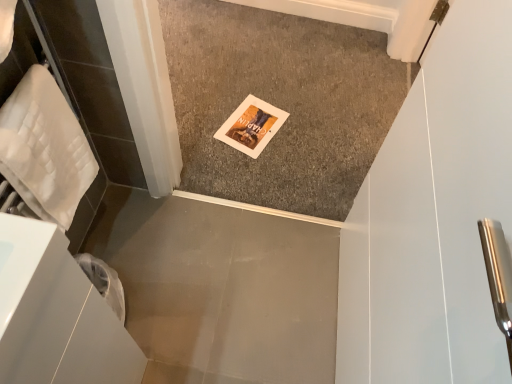
Question: Would you say smooth gray concrete at lower left, arranged as the 2th concrete when viewed from the top, is outside carpeted floor at center, positioned as the first concrete in back-to-front order?

Choices:
 (A) yes
 (B) no

Answer: (A)

Question: From the image's perspective, is smooth gray concrete at lower left, the 1th concrete ordered from the bottom, on carpeted floor at center, positioned as the first concrete in back-to-front order?

Choices:
 (A) no
 (B) yes

Answer: (A)

Question: Considering the relative sizes of smooth gray concrete at lower left, marked as the second concrete in a back-to-front arrangement, and carpeted floor at center, the 1th concrete from the top, in the image provided, is smooth gray concrete at lower left, marked as the second concrete in a back-to-front arrangement, shorter than carpeted floor at center, the 1th concrete from the top,?

Choices:
 (A) yes
 (B) no

Answer: (A)

Question: From a real-world perspective, is smooth gray concrete at lower left, arranged as the 2th concrete when viewed from the top, under carpeted floor at center, the 1th concrete from the top?

Choices:
 (A) yes
 (B) no

Answer: (A)

Question: From the image's perspective, is smooth gray concrete at lower left, arranged as the 2th concrete when viewed from the top, under carpeted floor at center, the 1th concrete from the top?

Choices:
 (A) no
 (B) yes

Answer: (B)

Question: Is smooth gray concrete at lower left, marked as the second concrete in a back-to-front arrangement, thinner than carpeted floor at center, positioned as the first concrete in back-to-front order?

Choices:
 (A) yes
 (B) no

Answer: (A)

Question: Can you confirm if white quilted towel at left is wider than carpeted floor at center, which is the 2th concrete from front to back?

Choices:
 (A) yes
 (B) no

Answer: (B)

Question: Is carpeted floor at center, which is the 2th concrete from front to back, at the back of white quilted towel at left?

Choices:
 (A) yes
 (B) no

Answer: (B)

Question: Is white quilted towel at left positioned behind carpeted floor at center, positioned as the first concrete in back-to-front order?

Choices:
 (A) yes
 (B) no

Answer: (B)

Question: Does white quilted towel at left have a smaller size compared to carpeted floor at center, which is the 2th concrete from front to back?

Choices:
 (A) no
 (B) yes

Answer: (B)

Question: Is the surface of white quilted towel at left in direct contact with carpeted floor at center, which ranks as the 2th concrete in bottom-to-top order?

Choices:
 (A) yes
 (B) no

Answer: (B)

Question: Does white quilted towel at left have a lesser height compared to carpeted floor at center, which ranks as the 2th concrete in bottom-to-top order?

Choices:
 (A) yes
 (B) no

Answer: (B)

Question: Does carpeted floor at center, which is the 2th concrete from front to back, have a smaller size compared to smooth gray concrete at lower left, marked as the second concrete in a back-to-front arrangement?

Choices:
 (A) no
 (B) yes

Answer: (A)